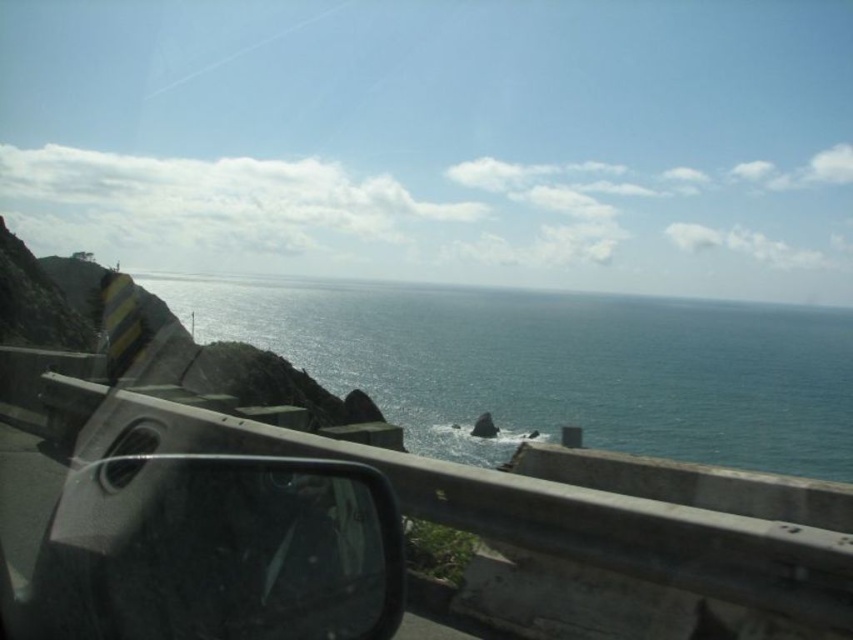
Does point (804, 376) come closer to viewer compared to point (164, 564)?

No, (804, 376) is behind (164, 564).

Can you confirm if blue water at center is positioned below glossy plastic view mirror at lower left?

Incorrect, blue water at center is not positioned below glossy plastic view mirror at lower left.

Locate an element on the screen. blue water at center is located at coordinates (556, 365).

The height and width of the screenshot is (640, 853). What are the coordinates of `blue water at center` in the screenshot? It's located at (556, 365).